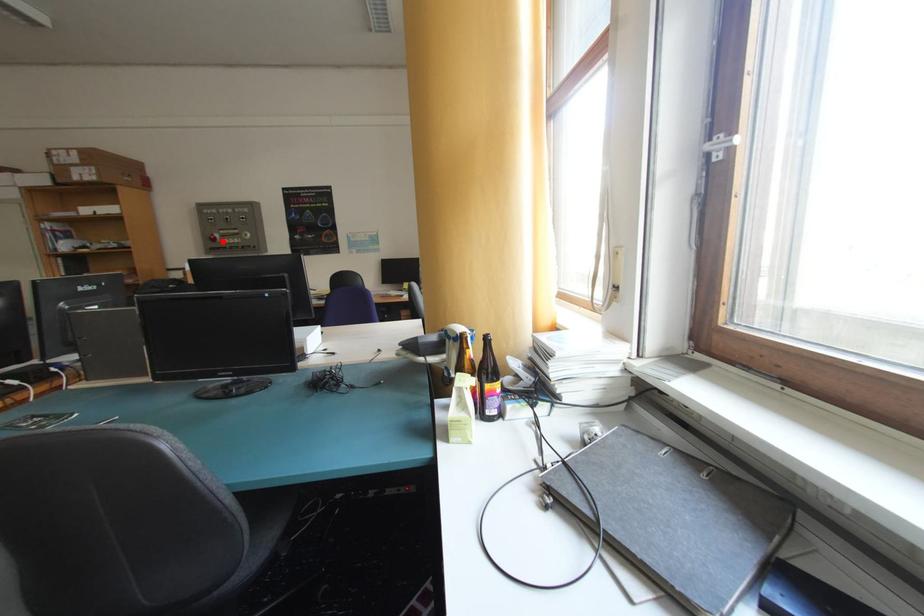
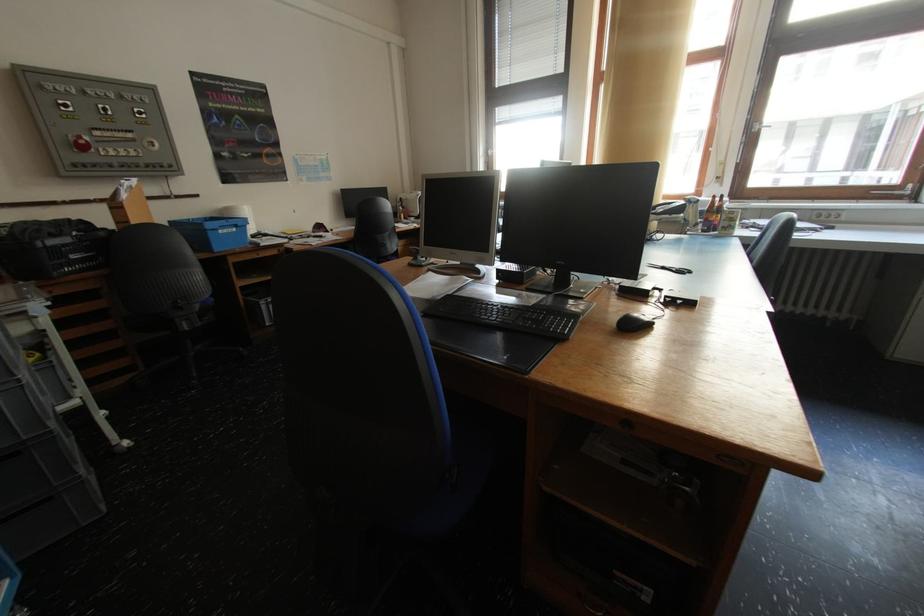
Where in the second image is the point corresponding to the highlighted location from the first image?

(91, 148)